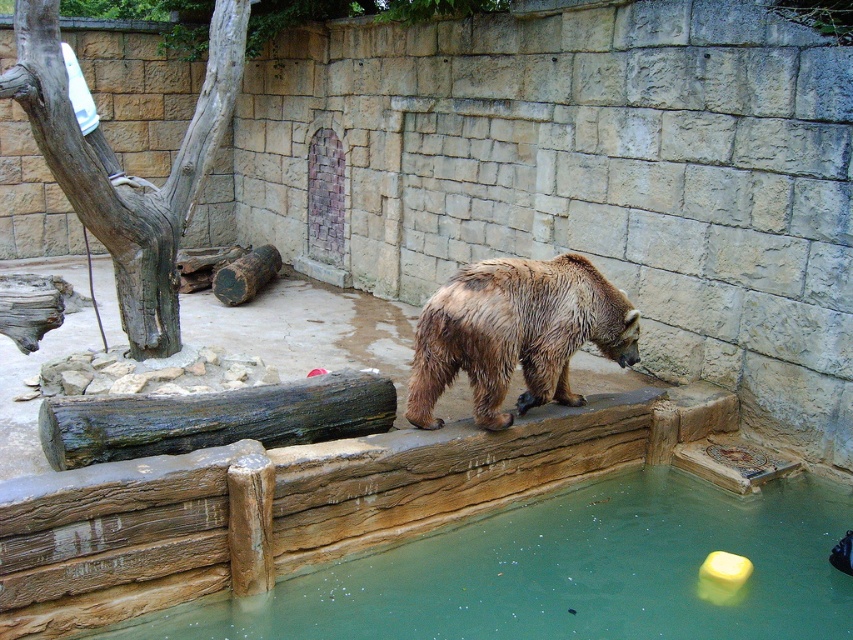
Question: Estimate the real-world distances between objects in this image. Which object is farther from the greenish water at lower center?

Choices:
 (A) weathered wood log at center
 (B) wet fur bear at center

Answer: (A)

Question: Does greenish water at lower center appear over weathered wood log at center?

Choices:
 (A) yes
 (B) no

Answer: (B)

Question: Does greenish water at lower center have a lesser width compared to wet fur bear at center?

Choices:
 (A) no
 (B) yes

Answer: (A)

Question: Is wet fur bear at center wider than weathered wood log at center?

Choices:
 (A) yes
 (B) no

Answer: (B)

Question: Which object is positioned closest to the greenish water at lower center?

Choices:
 (A) weathered wood log at center
 (B) wet fur bear at center

Answer: (B)

Question: Which point is farther to the camera?

Choices:
 (A) wet fur bear at center
 (B) weathered wood log at center

Answer: (A)